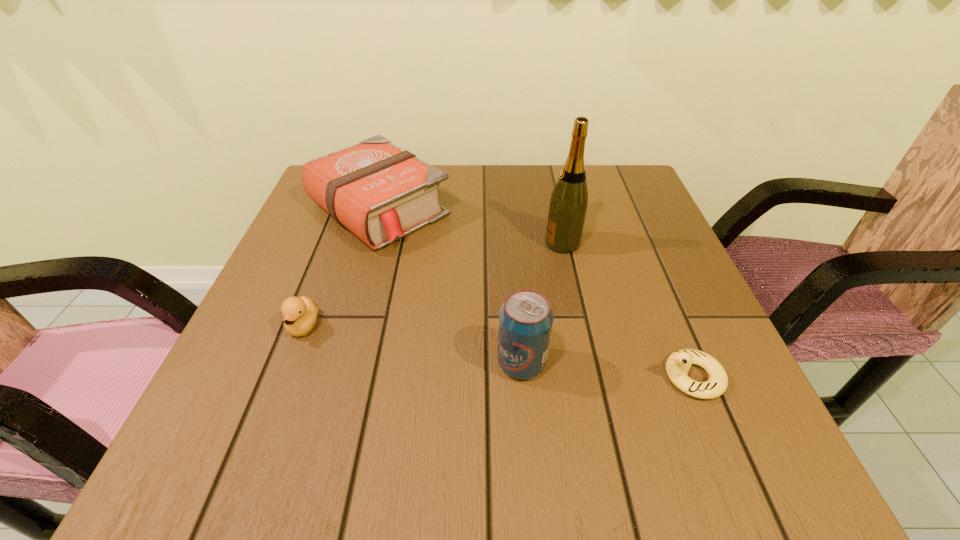
The height and width of the screenshot is (540, 960). Identify the location of vacant position located on the front-facing side of the wine bottle. (441, 243).

Where is `free spot located 0.350m on the front-facing side of the wine bottle`? The image size is (960, 540). free spot located 0.350m on the front-facing side of the wine bottle is located at coordinates (387, 243).

Where is `vacant space situated 0.290m on the back of the pop soda`? The width and height of the screenshot is (960, 540). vacant space situated 0.290m on the back of the pop soda is located at coordinates pos(512,241).

You are a GUI agent. You are given a task and a screenshot of the screen. Output one action in this format:
    pyautogui.click(x=<x>, y=<y>)
    Task: Click on the free space located 0.330m on the right of the Bible
    
    Given the screenshot: What is the action you would take?
    pyautogui.click(x=588, y=210)

Image resolution: width=960 pixels, height=540 pixels. Identify the location of vacant area situated 0.060m facing forward on the farther duckling. (286, 373).

The width and height of the screenshot is (960, 540). I want to click on blank area located on the face of the shorter duckling, so click(593, 377).

Where is `vacant area situated 0.100m on the face of the shorter duckling`? This screenshot has height=540, width=960. vacant area situated 0.100m on the face of the shorter duckling is located at coordinates (599, 377).

Where is `free point located on the face of the shorter duckling`? free point located on the face of the shorter duckling is located at coordinates (459, 377).

I want to click on object located in the far edge section of the desktop, so click(x=379, y=192).

Locate an element on the screen. Bible at the left edge is located at coordinates click(x=379, y=192).